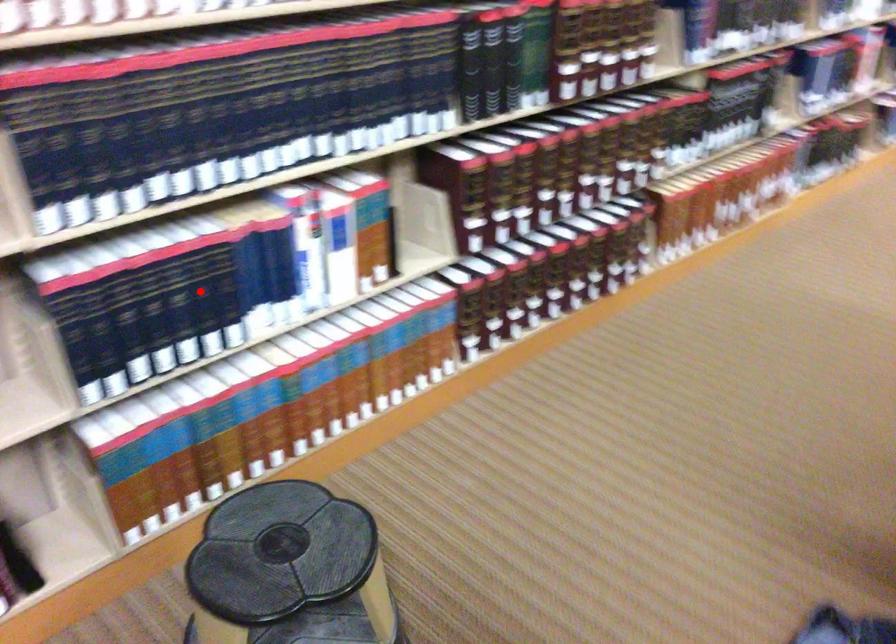
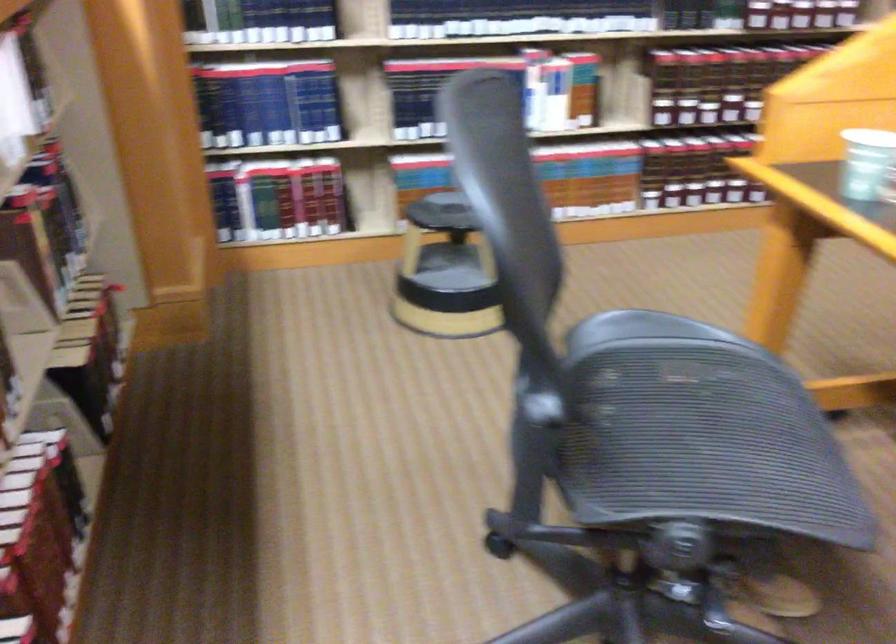
Question: I am providing you with two images of the same scene from different viewpoints. A red point is marked on the first image. At the location where the point appears in image 1, is it still visible in image 2?

Choices:
 (A) Yes
 (B) No

Answer: (B)